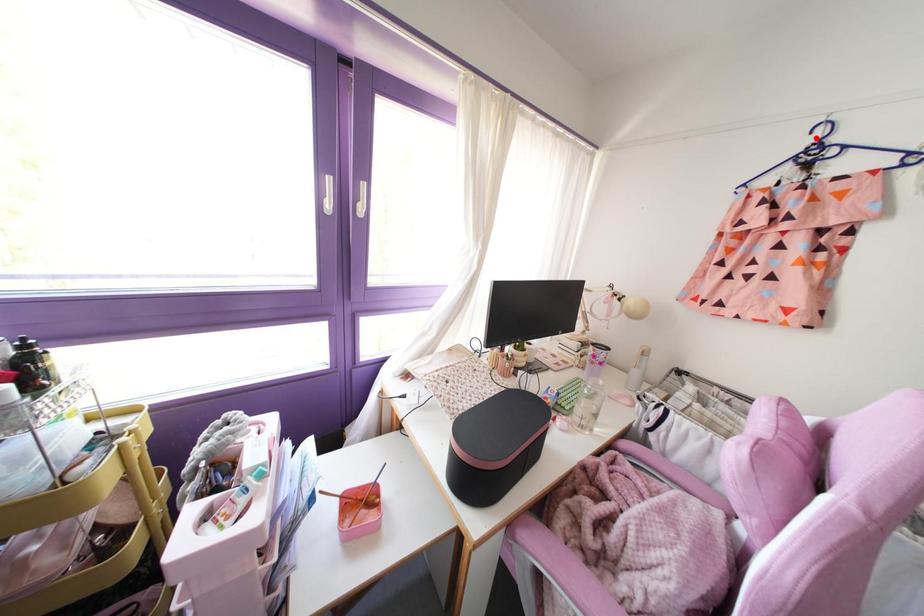
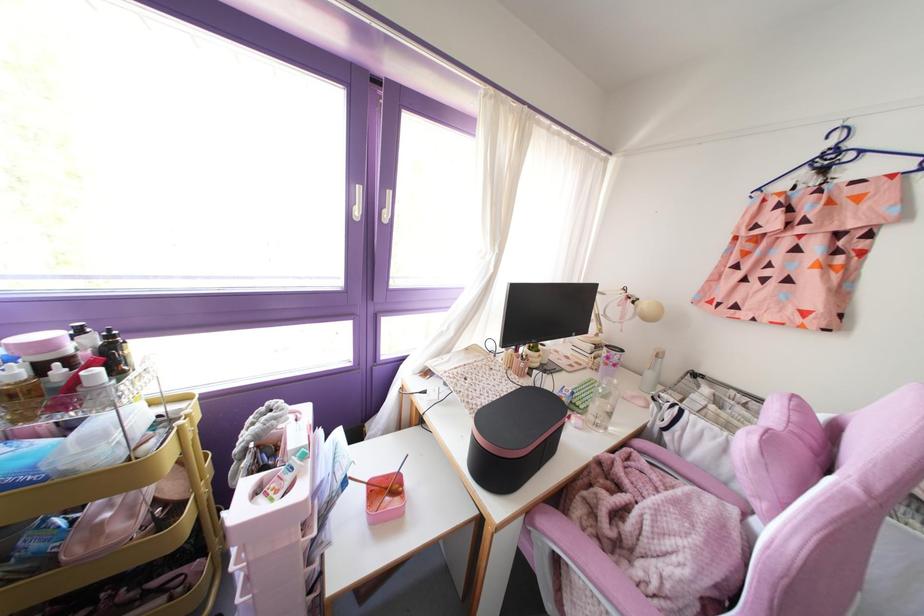
Find the pixel in the second image that matches the highlighted location in the first image.

(832, 143)